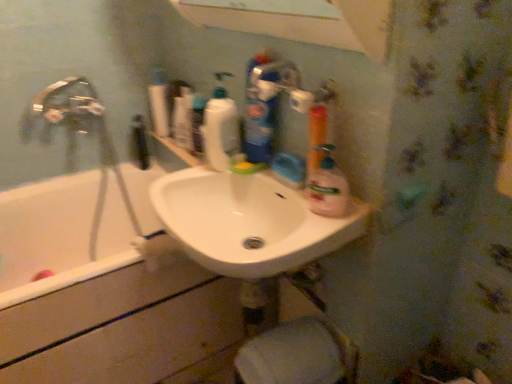
Where is `unoccupied area in front of translucent plastic spray bottle at center, which is the first cleaning product in right-to-left order`? unoccupied area in front of translucent plastic spray bottle at center, which is the first cleaning product in right-to-left order is located at coordinates (314, 231).